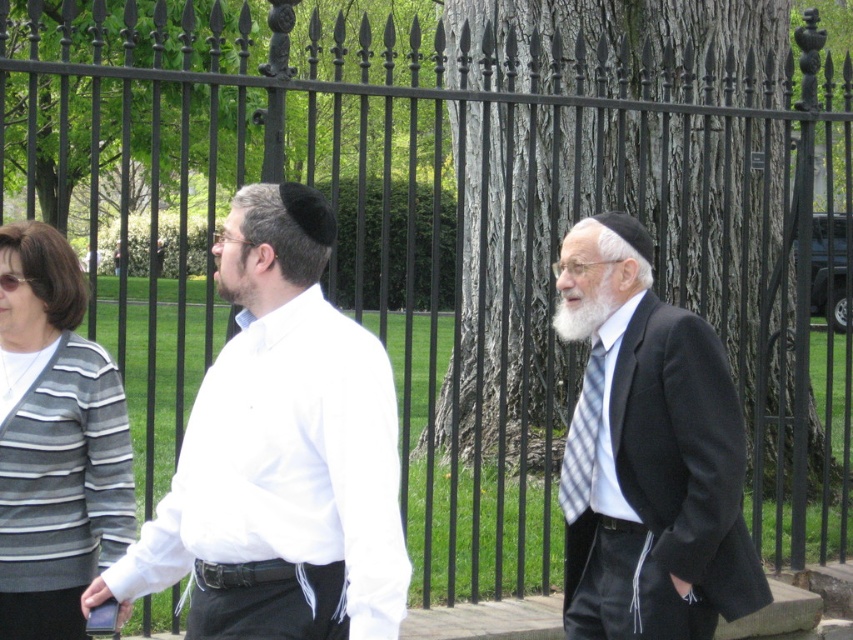
Question: Does white matte shirt at center appear on the right side of blue plaid tie at center?

Choices:
 (A) yes
 (B) no

Answer: (B)

Question: Which object is farther from the camera taking this photo?

Choices:
 (A) striped knit cardigan at left
 (B) white matte shirt at center
 (C) black wool suit at right
 (D) blue plaid tie at center

Answer: (D)

Question: Which object is the closest to the blue plaid tie at center?

Choices:
 (A) white matte shirt at center
 (B) whitehairbeard at center

Answer: (B)

Question: Can you confirm if striped knit cardigan at left is positioned to the left of blue plaid tie at center?

Choices:
 (A) yes
 (B) no

Answer: (A)

Question: Does blue plaid tie at center appear on the left side of whitehairbeard at center?

Choices:
 (A) no
 (B) yes

Answer: (A)

Question: Which point is farther from the camera taking this photo?

Choices:
 (A) (581, 504)
 (B) (44, 268)
 (C) (257, 541)
 (D) (582, 413)

Answer: (D)